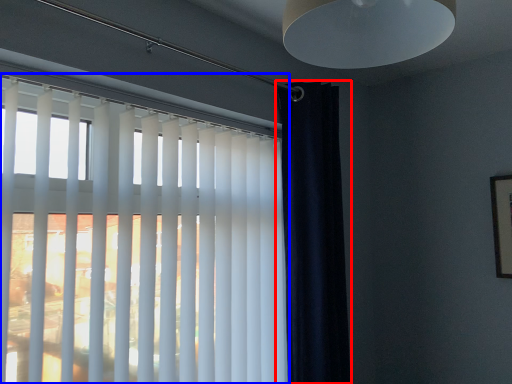
Question: Which object is closer to the camera taking this photo, curtain (highlighted by a red box) or window blind (highlighted by a blue box)?

Choices:
 (A) curtain
 (B) window blind

Answer: (B)